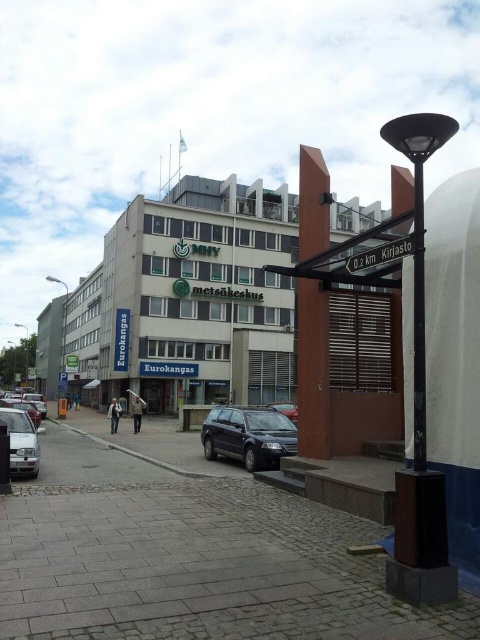
You are a delivery driver who needs to park your car in the parking area near the building. You see a white plastic sign at center and a metallic silver car at center. Which object is smaller and should be avoided to prevent damage while parking?

The white plastic sign at center is smaller than the metallic silver car at center. Therefore, you should avoid hitting the white plastic sign at center while parking to prevent damage.